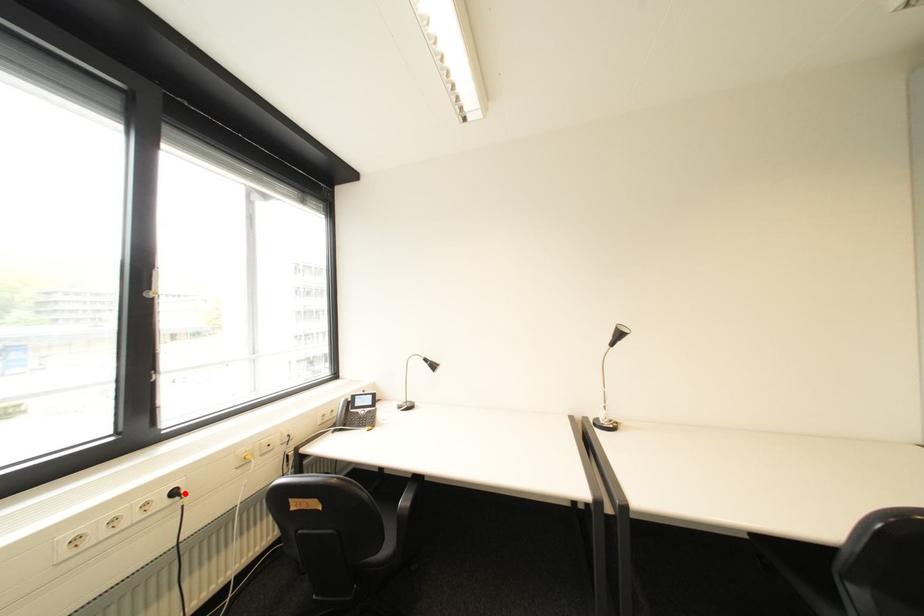
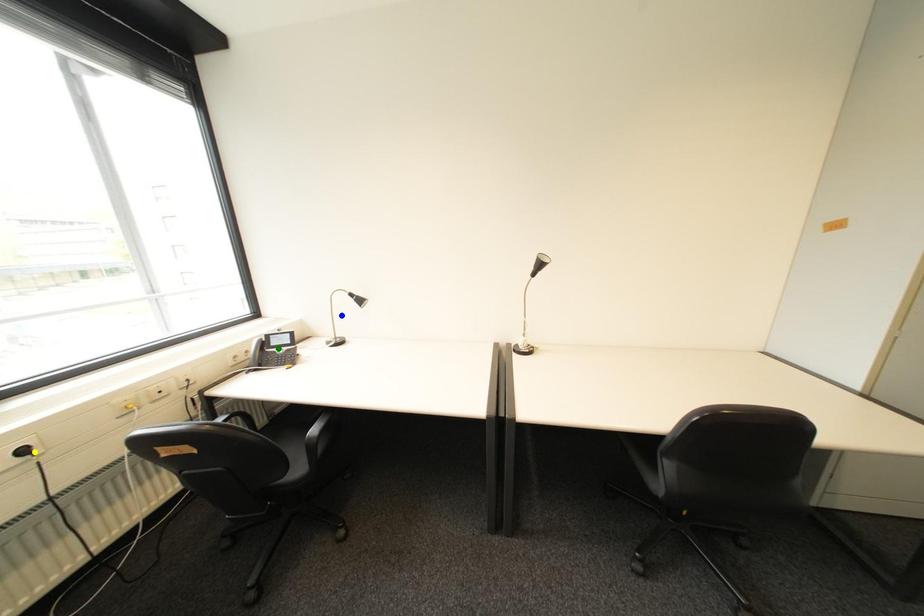
Question: I am providing you with two images of the same scene from different viewpoints. A red point is marked on the first image. You are given multiple points on the second image. Which point in image 2 is actually the same real-world point as the red point in image 1?

Choices:
 (A) blue point
 (B) green point
 (C) yellow point

Answer: (C)